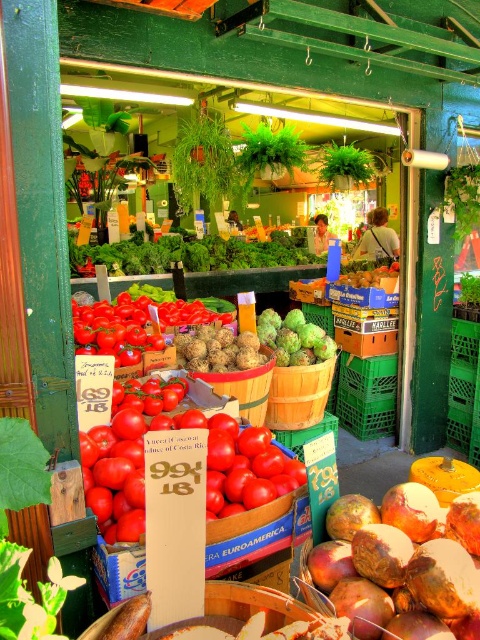
Question: Is the position of green leafy at center more distant than that of green matte pineapple at center?

Choices:
 (A) no
 (B) yes

Answer: (B)

Question: Which point appears farthest from the camera in this image?

Choices:
 (A) (169, 241)
 (B) (397, 580)

Answer: (A)

Question: Based on their relative distances, which object is farther from the green leafy at center?

Choices:
 (A) green matte pineapple at center
 (B) rustic brown root at center

Answer: (B)

Question: Among these objects, which one is nearest to the camera?

Choices:
 (A) green leafy at center
 (B) green matte pineapple at center

Answer: (B)

Question: Can you confirm if green leafy at center is bigger than green matte pineapple at center?

Choices:
 (A) yes
 (B) no

Answer: (A)

Question: From the image, what is the correct spatial relationship of rustic brown root at center in relation to green matte pineapple at center?

Choices:
 (A) right
 (B) left

Answer: (A)